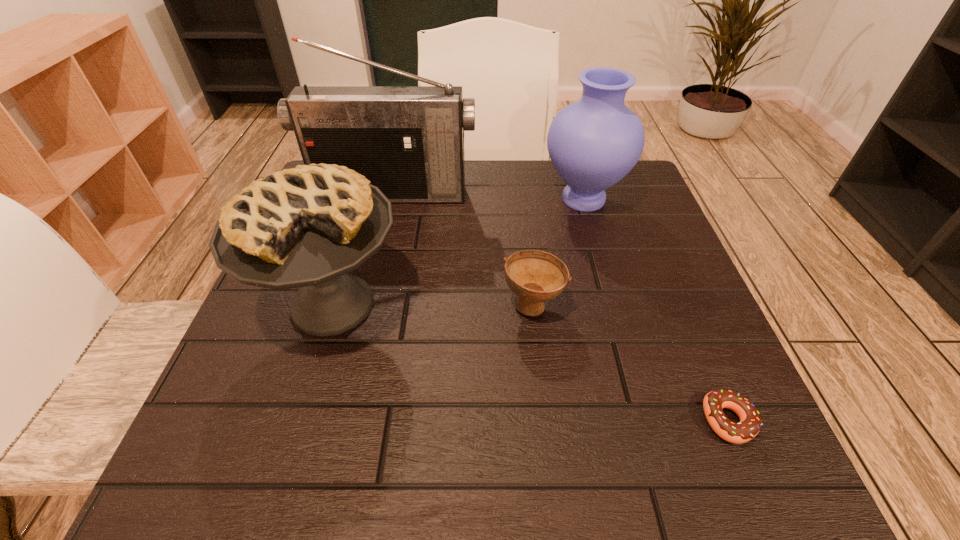
Find the location of a particular element. The image size is (960, 540). blank space located on the left of the shortest object is located at coordinates (554, 420).

You are a GUI agent. You are given a task and a screenshot of the screen. Output one action in this format:
    pyautogui.click(x=<x>, y=<y>)
    Task: Click on the radio receiver at the far edge
    
    Given the screenshot: What is the action you would take?
    pyautogui.click(x=408, y=141)

The image size is (960, 540). In order to click on vase at the far edge in this screenshot , I will do `click(593, 143)`.

Locate an element on the screen. Image resolution: width=960 pixels, height=540 pixels. object positioned at the near edge is located at coordinates (750, 423).

The height and width of the screenshot is (540, 960). I want to click on radio receiver that is at the left edge, so click(x=408, y=141).

Image resolution: width=960 pixels, height=540 pixels. I want to click on pie at the left edge, so click(309, 226).

The height and width of the screenshot is (540, 960). In order to click on vase that is at the right edge in this screenshot , I will do `click(593, 143)`.

Identify the location of doughnut located in the right edge section of the desktop. (750, 423).

The width and height of the screenshot is (960, 540). I want to click on object at the far left corner, so click(408, 141).

I want to click on object at the far right corner, so click(593, 143).